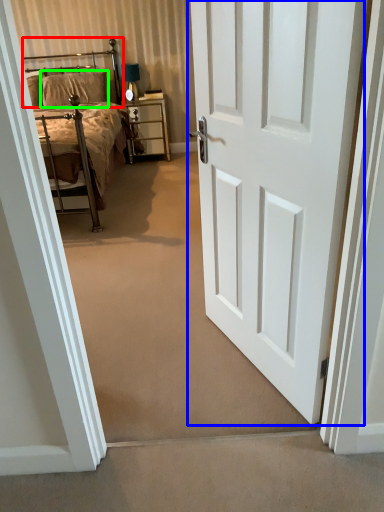
Question: Based on their relative distances, which object is farther from headboard (highlighted by a red box)? Choose from door (highlighted by a blue box) and pillow (highlighted by a green box).

Choices:
 (A) door
 (B) pillow

Answer: (A)